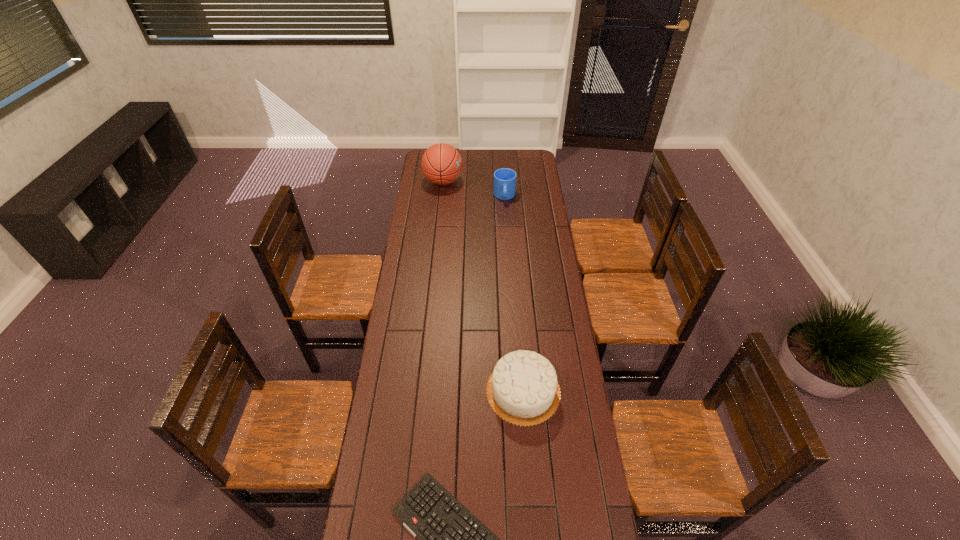
The height and width of the screenshot is (540, 960). I want to click on vacant space at the left edge of the desktop, so click(x=421, y=174).

I want to click on vacant region at the right edge of the desktop, so click(x=558, y=436).

Locate an element on the screen. The width and height of the screenshot is (960, 540). blank region between the third tallest object and the second nearest object is located at coordinates (514, 294).

Where is `unoccupied position between the basketball and the third shortest object`? The height and width of the screenshot is (540, 960). unoccupied position between the basketball and the third shortest object is located at coordinates (483, 286).

Identify the location of free spot between the third shortest object and the tallest object. (483, 286).

Where is `free spot between the tallest object and the third tallest object`? free spot between the tallest object and the third tallest object is located at coordinates (474, 189).

Locate an element on the screen. This screenshot has height=540, width=960. object that is the third closest to the nearest object is located at coordinates (441, 163).

Image resolution: width=960 pixels, height=540 pixels. I want to click on the closest object to the birthday cake, so click(452, 539).

Where is `vacant space that satisfies the following two spatial constraints: 1. on the logo side of the birthday cake; 2. on the left side of the tallest object`? The width and height of the screenshot is (960, 540). vacant space that satisfies the following two spatial constraints: 1. on the logo side of the birthday cake; 2. on the left side of the tallest object is located at coordinates (421, 391).

The width and height of the screenshot is (960, 540). In order to click on vacant space that satisfies the following two spatial constraints: 1. on the side of the third farthest object with the handle; 2. on the right side of the third tallest object in this screenshot , I will do `click(517, 391)`.